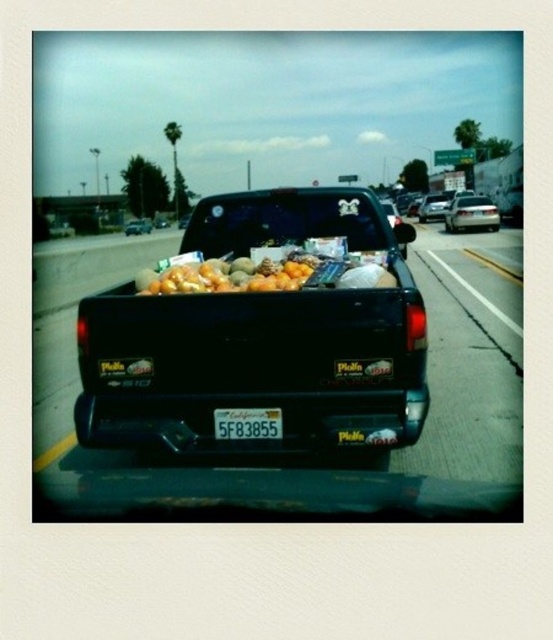
Question: Which of the following is the farthest from the observer?

Choices:
 (A) (220, 420)
 (B) (401, 362)
 (C) (274, 260)

Answer: (C)

Question: Which object is farther from the camera taking this photo?

Choices:
 (A) black matte truck bed at center
 (B) white plastic license plate at center

Answer: (A)

Question: Which of the following is the farthest from the observer?

Choices:
 (A) white plastic license plate at center
 (B) black matte truck bed at center
 (C) orange matte melons at center

Answer: (C)

Question: Is black matte truck bed at center smaller than orange matte melons at center?

Choices:
 (A) yes
 (B) no

Answer: (B)

Question: Where is black matte truck bed at center located in relation to orange matte melons at center in the image?

Choices:
 (A) left
 (B) right

Answer: (B)

Question: Can you confirm if black matte truck bed at center is positioned to the right of white plastic license plate at center?

Choices:
 (A) yes
 (B) no

Answer: (A)